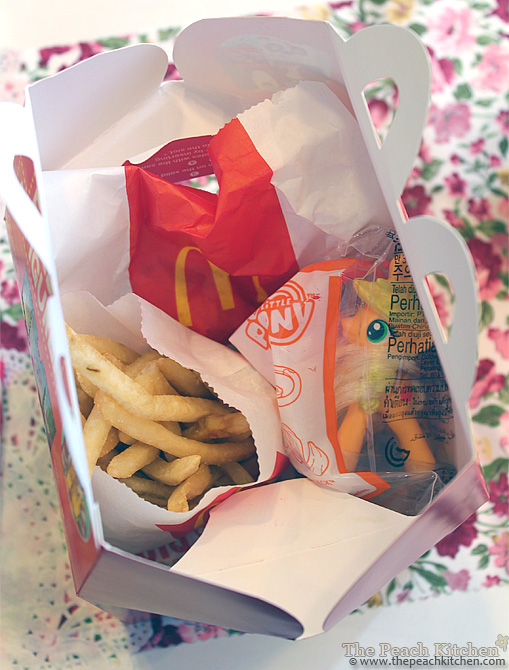
Where is `left toy eye`? This screenshot has height=670, width=509. left toy eye is located at coordinates (375, 332).